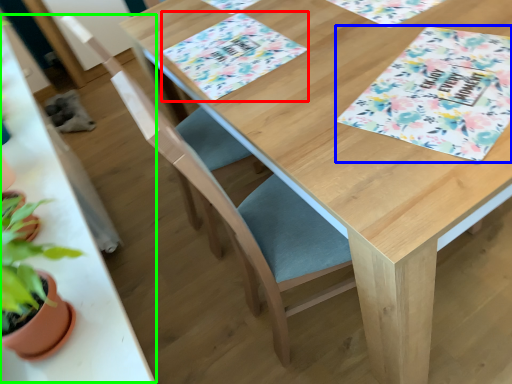
Question: Based on their relative distances, which object is farther from place mat (highlighted by a red box)? Choose from tablecloth (highlighted by a blue box) and round table (highlighted by a green box).

Choices:
 (A) tablecloth
 (B) round table

Answer: (B)